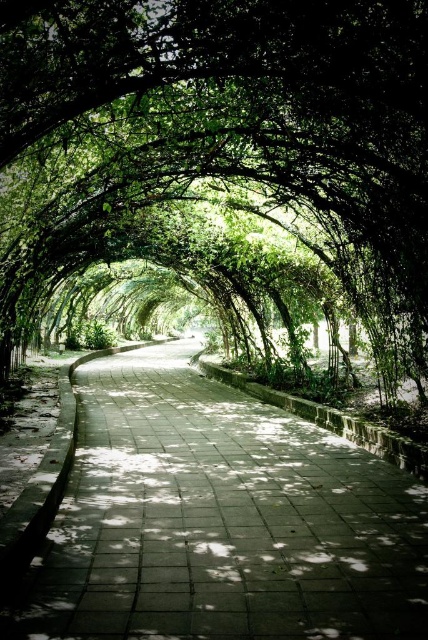
Does green leafy archway at center appear on the left side of concrete paving at center?

Correct, you'll find green leafy archway at center to the left of concrete paving at center.

Describe the element at coordinates (222, 122) in the screenshot. I see `green leafy archway at center` at that location.

In the scene shown: Who is more distant from viewer, (371, 52) or (145, 536)?

The point (371, 52) is more distant.

You are a GUI agent. You are given a task and a screenshot of the screen. Output one action in this format:
    pyautogui.click(x=<x>, y=<y>)
    Task: Click on the green leafy archway at center
    Image resolution: width=428 pixels, height=640 pixels.
    Given the screenshot: What is the action you would take?
    pyautogui.click(x=222, y=122)